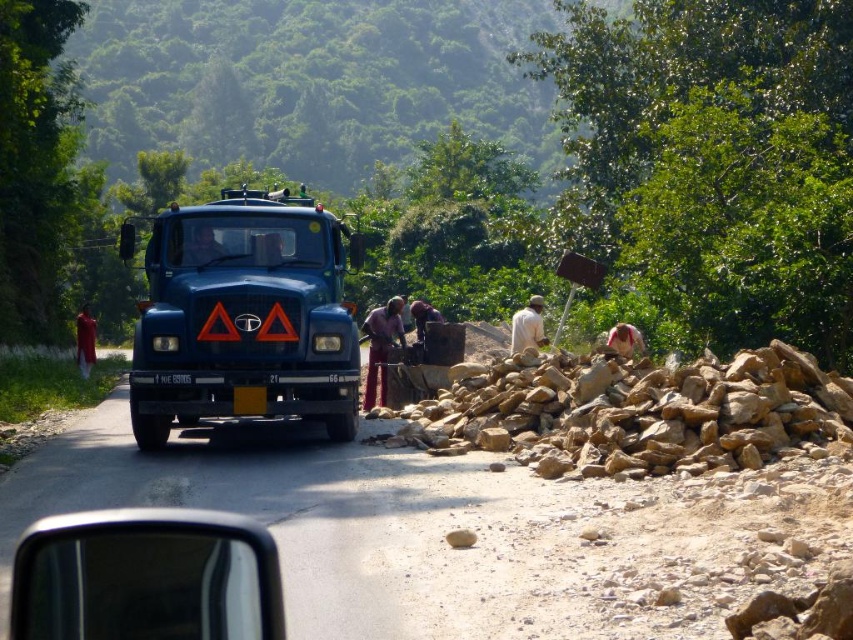
You are a delivery driver who needs to park your 6.5 meter long truck behind the blue metallic truck at center. The parking area is 15 meters long. Is there enough space for your truck?

The blue metallic truck at center is 12.67 meters from the camera. Since the parking area is 15 meters long, subtracting the truck length from the parking space length gives 15m minus 12.67m equals 2.33 meters remaining. This remaining space is insufficient for your 6.5 meter long truck. Therefore, there is not enough space.

You are a delivery driver who needs to park your car behind the blue metallic truck at center so that it doesn not block the road. Can you park your car behind the truck without hitting the brown rough rocks at right?

The blue metallic truck at center is bigger than brown rough rocks at right, so yes, you can park behind the truck without hitting the rocks because the truck itself is larger and likely provides enough space between it and the rocks for safe parking.

What are the coordinates of the blue metallic truck at center?

The blue metallic truck at center is located at coordinates point (247, 317).